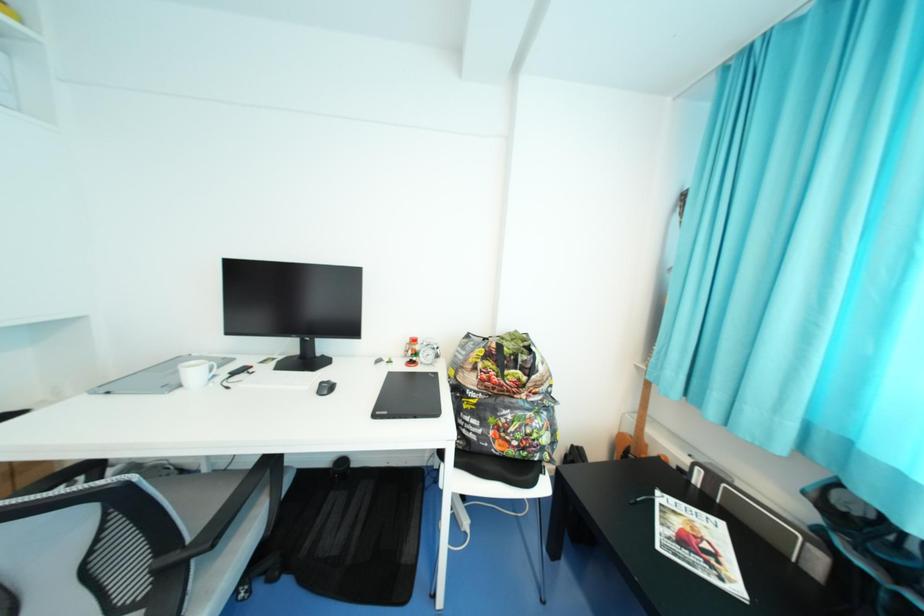
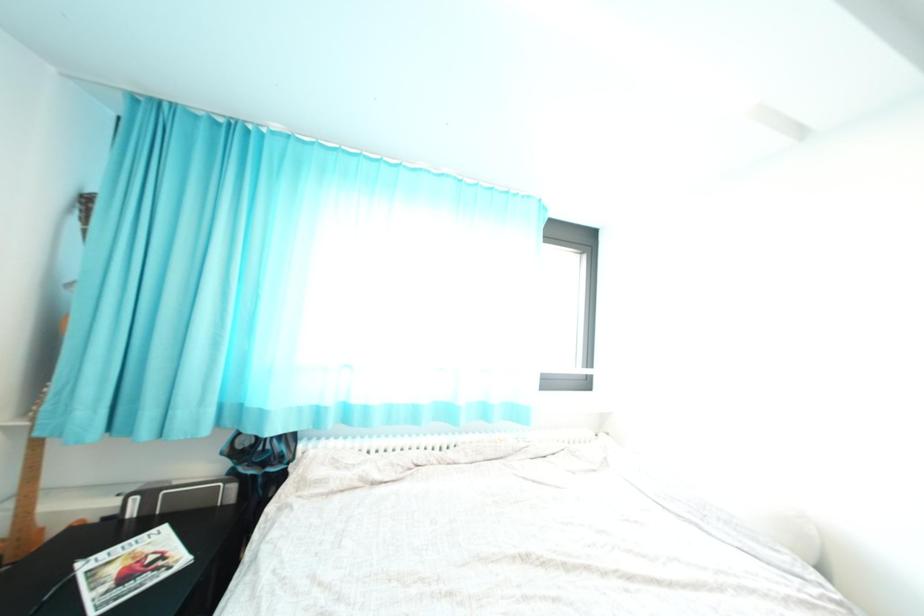
Question: The first image is from the beginning of the video and the second image is from the end. How did the camera likely rotate when shooting the video?

Choices:
 (A) Left
 (B) Right
 (C) Up
 (D) Down

Answer: (B)